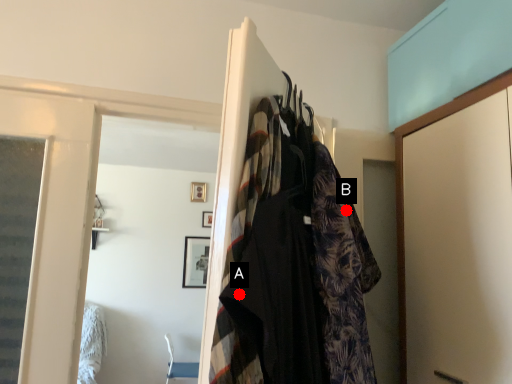
Question: Two points are circled on the image, labeled by A and B beside each circle. Which point is farther from the camera taking this photo?

Choices:
 (A) A is further
 (B) B is further

Answer: (B)